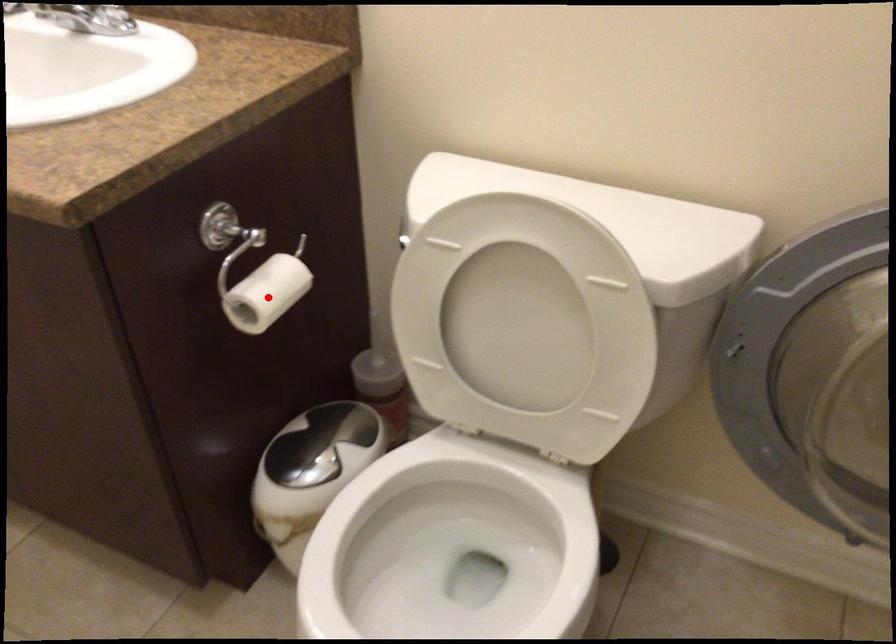
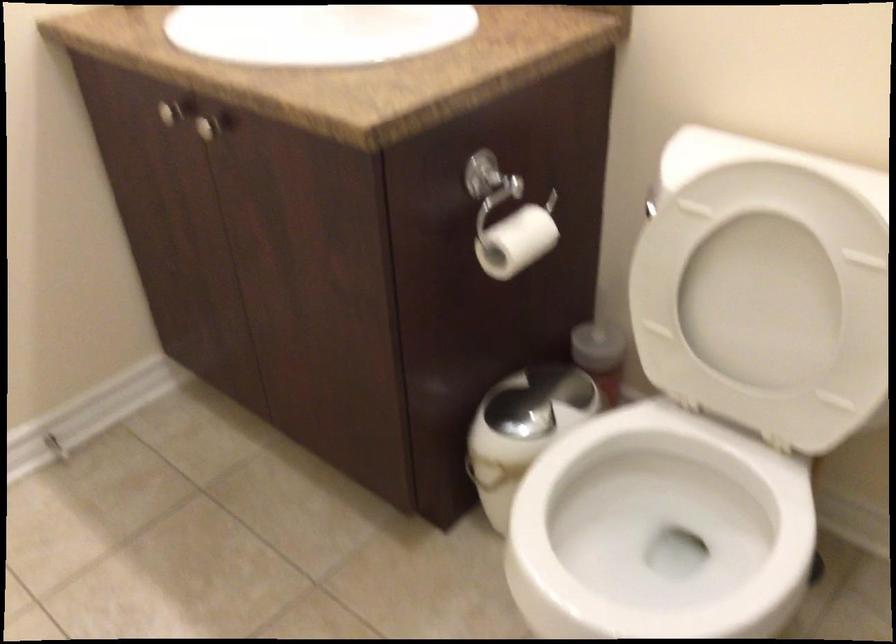
Question: I am providing you with two images of the same scene from different viewpoints. A red point is marked on the first image. At the location where the point appears in image 1, is it still visible in image 2?

Choices:
 (A) Yes
 (B) No

Answer: (A)